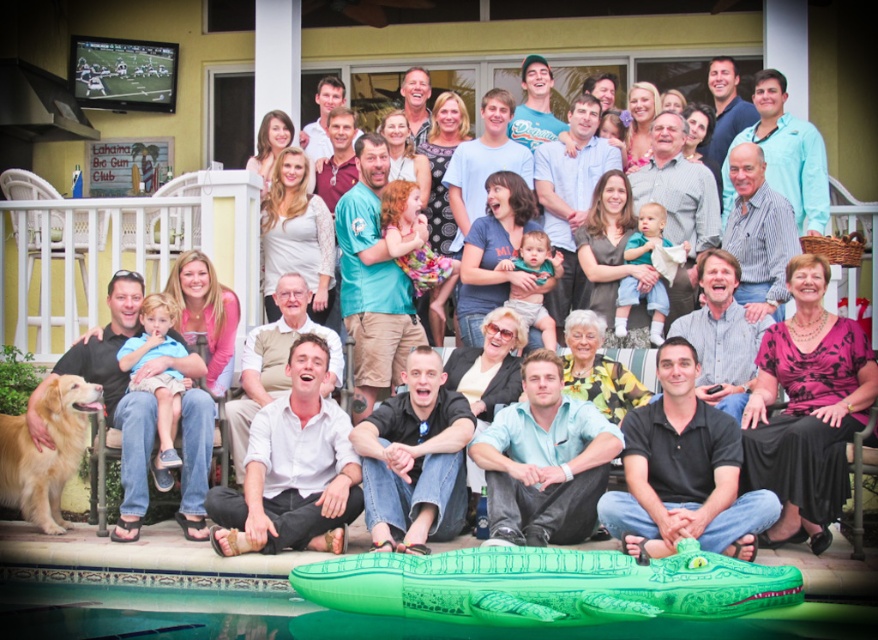
Does green inflatable boat at lower center appear on the right side of golden matte dog at lower left?

Indeed, green inflatable boat at lower center is positioned on the right side of golden matte dog at lower left.

Between green inflatable boat at lower center and golden matte dog at lower left, which one appears on the left side from the viewer's perspective?

From the viewer's perspective, golden matte dog at lower left appears more on the left side.

At what (x,y) coordinates should I click in order to perform the action: click on green inflatable boat at lower center. Please return your answer as a coordinate pair (x, y). Image resolution: width=878 pixels, height=640 pixels. Looking at the image, I should click on (545, 586).